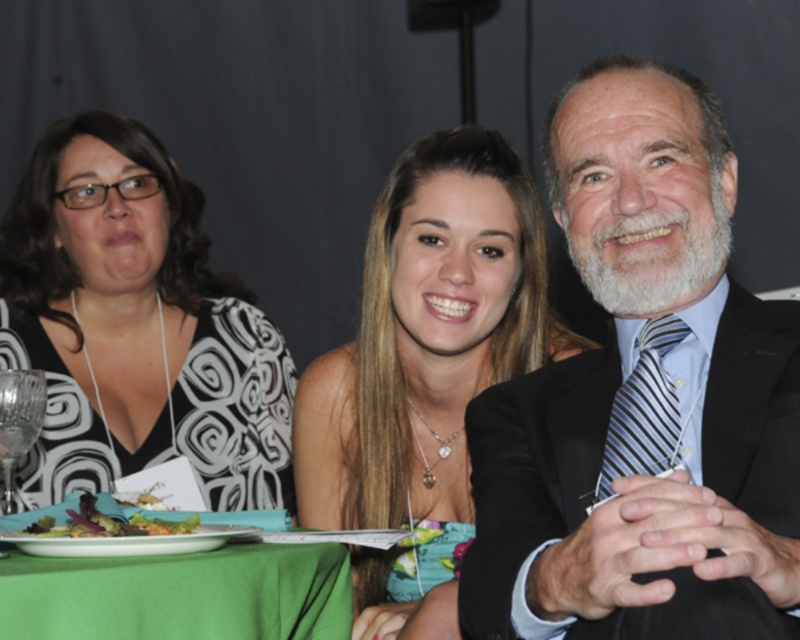
Who is lower down, green fabric table at lower left or green leafy salad at lower left?

green fabric table at lower left is lower down.

Between green fabric table at lower left and green leafy salad at lower left, which one appears on the right side from the viewer's perspective?

green fabric table at lower left

Find the location of a particular element. Image resolution: width=800 pixels, height=640 pixels. green fabric table at lower left is located at coordinates (180, 595).

Is dark blue suit at right positioned at the back of green fabric table at lower left?

No, dark blue suit at right is closer to the viewer.

Is dark blue suit at right to the right of green fabric table at lower left from the viewer's perspective?

Correct, you'll find dark blue suit at right to the right of green fabric table at lower left.

Locate an element on the screen. Image resolution: width=800 pixels, height=640 pixels. dark blue suit at right is located at coordinates (644, 397).

Who is more forward, (618, 188) or (82, 502)?

Point (618, 188) is more forward.

Is point (633, 563) closer to camera compared to point (34, 531)?

Yes, it is in front of point (34, 531).

Image resolution: width=800 pixels, height=640 pixels. I want to click on dark blue suit at right, so click(644, 397).